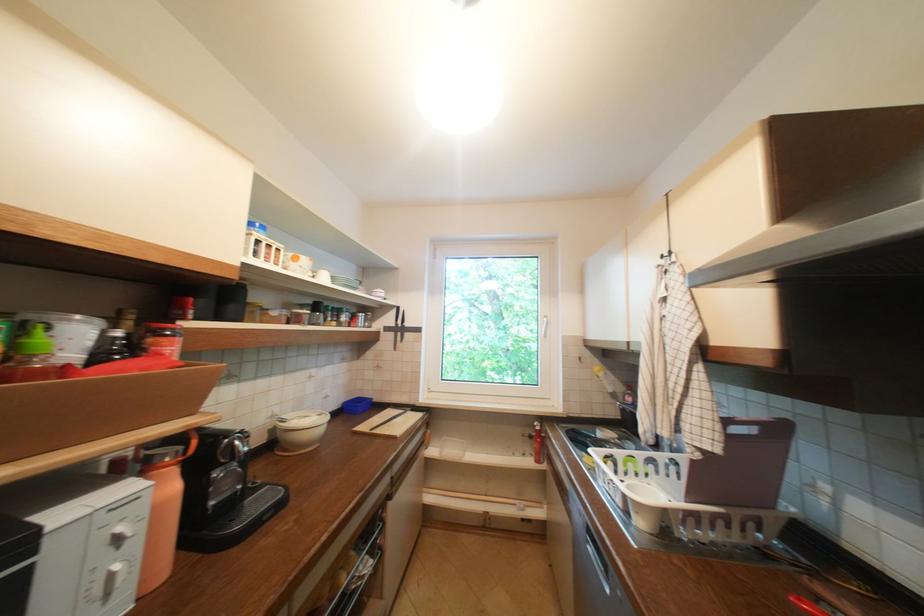
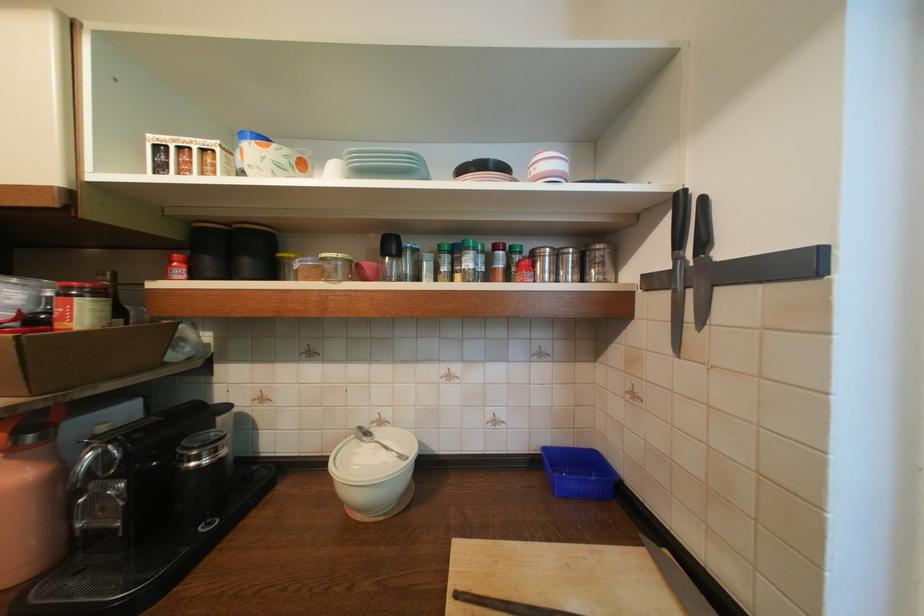
The point at (408,342) is marked in the first image. Where is the corresponding point in the second image?

(701, 326)